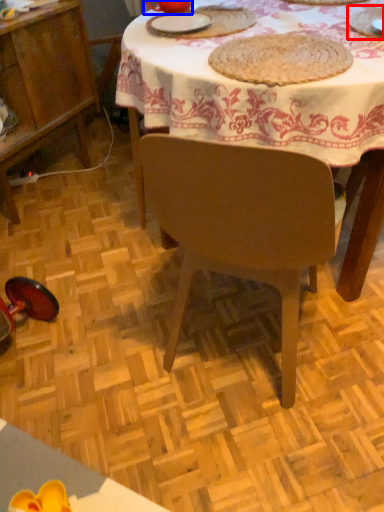
Question: Which point is further to the camera, tableware (highlighted by a red box) or tableware (highlighted by a blue box)?

Choices:
 (A) tableware
 (B) tableware

Answer: (B)